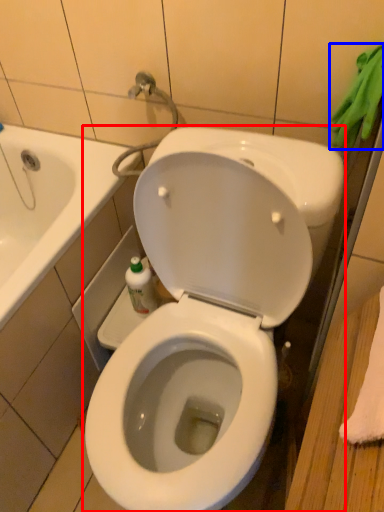
Question: Which point is closer to the camera, toilet (highlighted by a red box) or bath towel (highlighted by a blue box)?

Choices:
 (A) toilet
 (B) bath towel

Answer: (A)